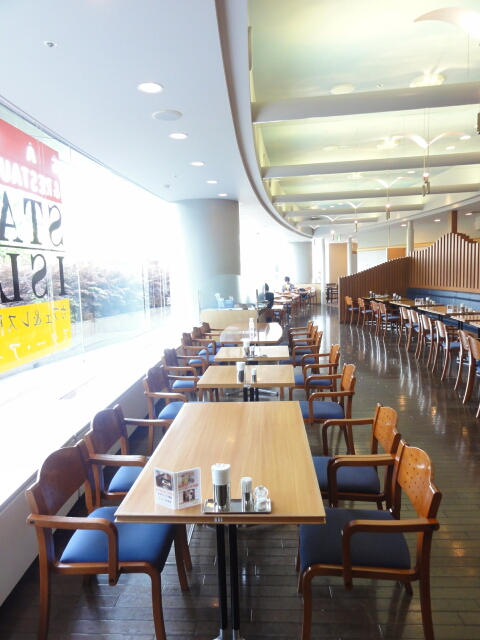
What are the coordinates of `lights` in the screenshot? It's located at (197, 160), (209, 180), (221, 192), (467, 212), (437, 218), (405, 224), (424, 178), (386, 205), (356, 219), (331, 230).